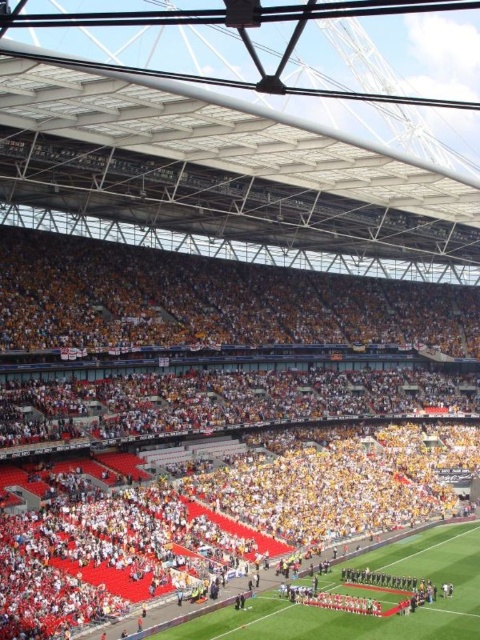
You are a drone operator preparing to fly a drone into the stadium. The drone needs to stay above the yellow fabric seats at center but must not fly higher than the green grass football field at center. Is this possible?

The yellow fabric seats at center has a greater height compared to green grass football field at center, so the drone cannot fly above the yellow fabric seats at center without exceeding the height limit set by the green grass football field at center.